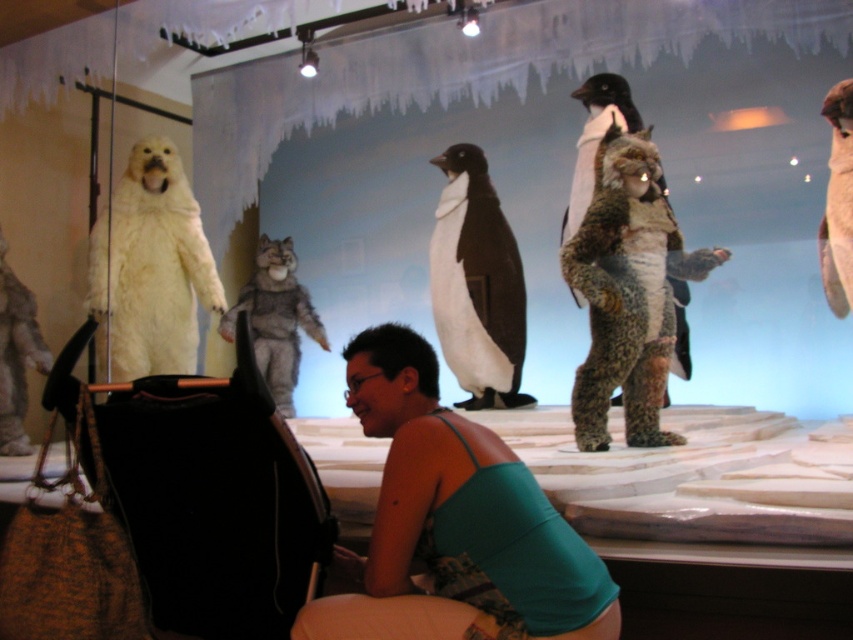
You are a museum visitor standing in front of the diorama. You notice the teal fabric tank top at center and the white fluffy penguin at upper right. Which object is wider?

Result: The teal fabric tank top at center is wider than the white fluffy penguin at upper right.

You are a visitor in the museum and want to take a photo of the white fluffy penguin at upper right without including the teal fabric tank top at center in the frame. Which direction should you move to achieve this?

Move to the right side of the scene to exclude the teal fabric tank top at center from the frame since it is positioned to the left of the white fluffy penguin at upper right.

Looking at this image, you are standing in the museum and want to take a photo of the point at coordinates (524, 307) in the diorama. If your camera has a focal length of 50mm and you need to be at least 4 meters away to avoid blurring, should you move closer or farther away?

The point at coordinates (524, 307) is 4.73 meters away from the viewer. Since the minimum required distance to avoid blurring is 4 meters, you should move closer to the point at coordinates (524, 307) but not beyond 4 meters.